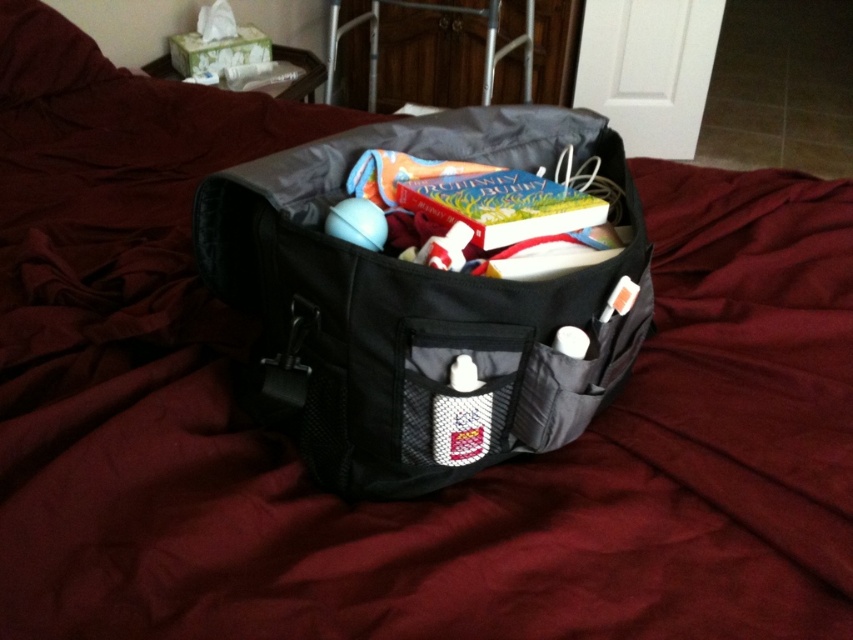
You are standing in the room and want to locate the black fabric bag at center. Based on the coordinates given, where would you find it?

The black fabric bag at center is located at the coordinates point (415, 307).

You are organizing items in a room and notice the black fabric bag at center and the white mesh pocket at center. Which object is located to the left of the other?

The white mesh pocket at center is located to the left of the black fabric bag at center because the black fabric bag at center is positioned on the right side of the white mesh pocket at center.

You need to place a rectangular item into either the black fabric bag at center or the white mesh pocket at center. Which one has a larger opening to accommodate the item?

The black fabric bag at center has a wider opening than the white mesh pocket at center, so it can accommodate the rectangular item better.